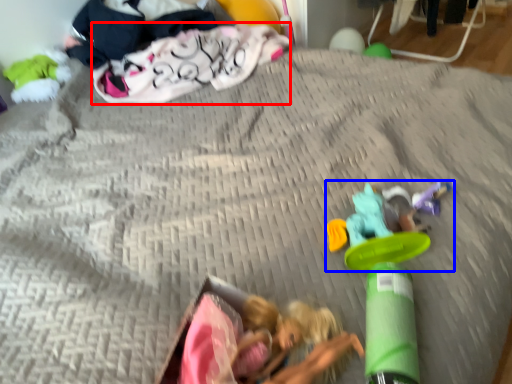
Question: Which object appears farthest to the camera in this image, clothing (highlighted by a red box) or toy (highlighted by a blue box)?

Choices:
 (A) clothing
 (B) toy

Answer: (A)